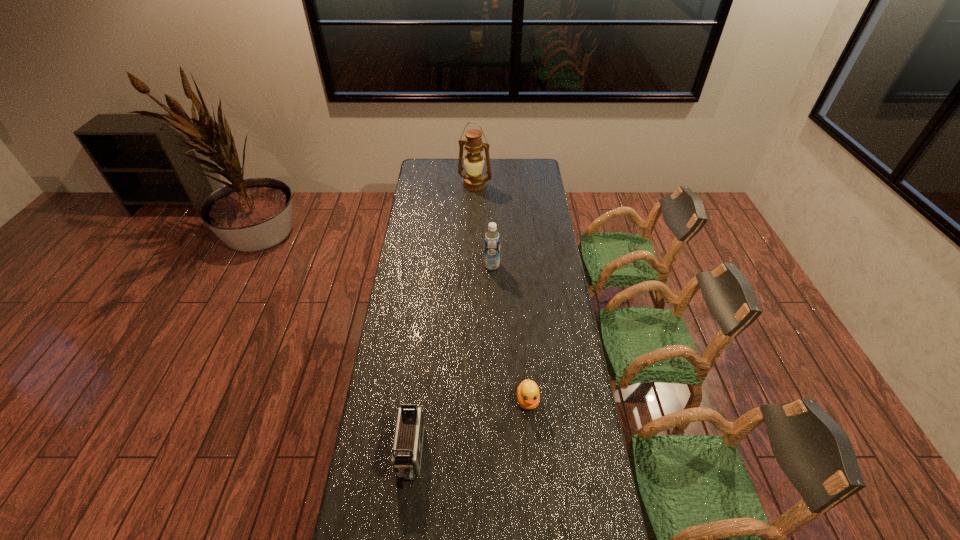
Where is `oil lamp`? The image size is (960, 540). oil lamp is located at coordinates (474, 181).

You are a GUI agent. You are given a task and a screenshot of the screen. Output one action in this format:
    pyautogui.click(x=<x>, y=<y>)
    Task: Click on the tallest object
    This screenshot has width=960, height=540.
    Given the screenshot: What is the action you would take?
    pyautogui.click(x=474, y=181)

Where is `the third shortest object`? This screenshot has width=960, height=540. the third shortest object is located at coordinates (491, 238).

Where is `the second farthest object`? the second farthest object is located at coordinates (491, 238).

Where is `the third tallest object`? Image resolution: width=960 pixels, height=540 pixels. the third tallest object is located at coordinates (407, 448).

Locate an element on the screen. Image resolution: width=960 pixels, height=540 pixels. the nearest object is located at coordinates (407, 448).

Image resolution: width=960 pixels, height=540 pixels. I want to click on the third farthest object, so click(528, 395).

The height and width of the screenshot is (540, 960). I want to click on the rightmost object, so click(528, 395).

The height and width of the screenshot is (540, 960). Identify the location of vacant area situated 0.220m on the right of the oil lamp. (529, 185).

What are the coordinates of `vacant space located on the label of the third nearest object` in the screenshot? It's located at (415, 265).